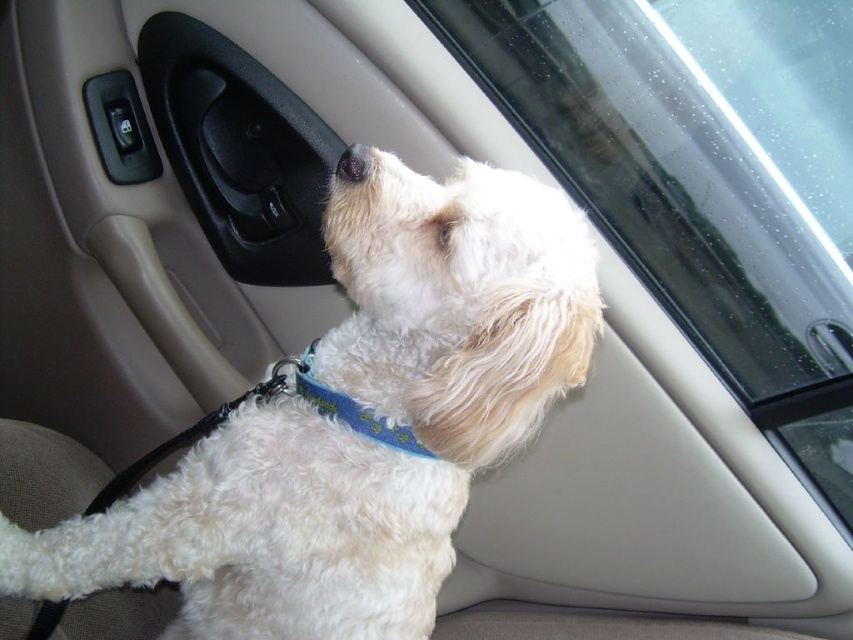
Looking at this image, is transparent glass window at upper right below blue fabric neckband at center?

No, transparent glass window at upper right is not below blue fabric neckband at center.

The height and width of the screenshot is (640, 853). In order to click on transparent glass window at upper right in this screenshot , I will do `click(700, 186)`.

Does point (474, 212) lie in front of point (654, 214)?

Yes, point (474, 212) is closer to viewer.

Is white fluffy dog at center taller than transparent glass window at upper right?

No, white fluffy dog at center is not taller than transparent glass window at upper right.

Is point (349, 477) farther from camera compared to point (788, 72)?

That is False.

Identify the location of white fluffy dog at center. (358, 422).

Which is in front, point (248, 564) or point (352, 150)?

Point (352, 150) is in front.

Between point (341, 412) and point (350, 164), which one is positioned behind?

The point (341, 412) is more distant.

What are the coordinates of `white fluffy dog at center` in the screenshot? It's located at (358, 422).